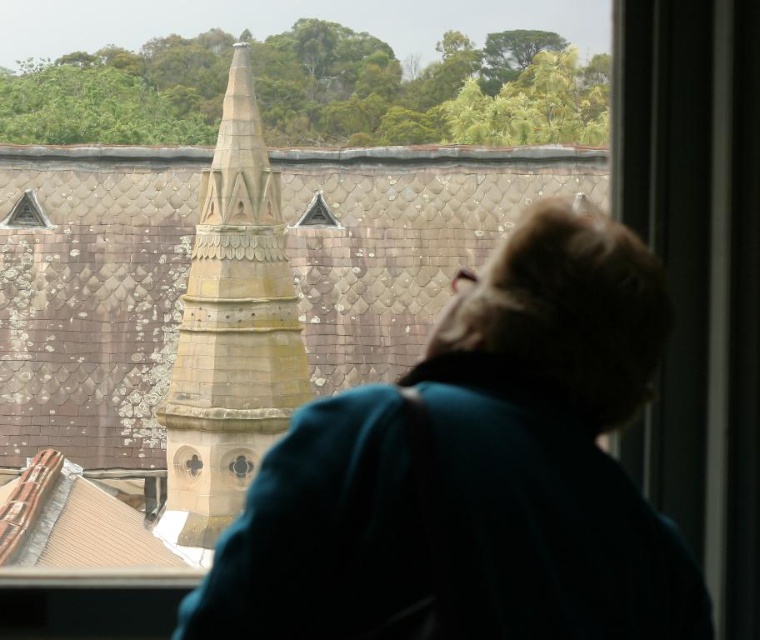
Question: Which point is farther to the camera?

Choices:
 (A) (27, 193)
 (B) (242, 99)
 (C) (388, 500)

Answer: (A)

Question: Does brown textured steeple at center lie in front of transparent glass triangle at upper left?

Choices:
 (A) yes
 (B) no

Answer: (A)

Question: Observing the image, what is the correct spatial positioning of teal fabric coat at center in reference to brown textured steeple at center?

Choices:
 (A) below
 (B) above

Answer: (A)

Question: Among these objects, which one is nearest to the camera?

Choices:
 (A) teal fabric coat at center
 (B) transparent glass triangle at upper left
 (C) brown textured steeple at center

Answer: (A)

Question: Can you confirm if teal fabric coat at center is positioned below transparent glass triangle at upper left?

Choices:
 (A) yes
 (B) no

Answer: (A)

Question: Based on their relative distances, which object is nearer to the brown textured steeple at center?

Choices:
 (A) transparent glass triangle at upper left
 (B) teal fabric coat at center

Answer: (A)